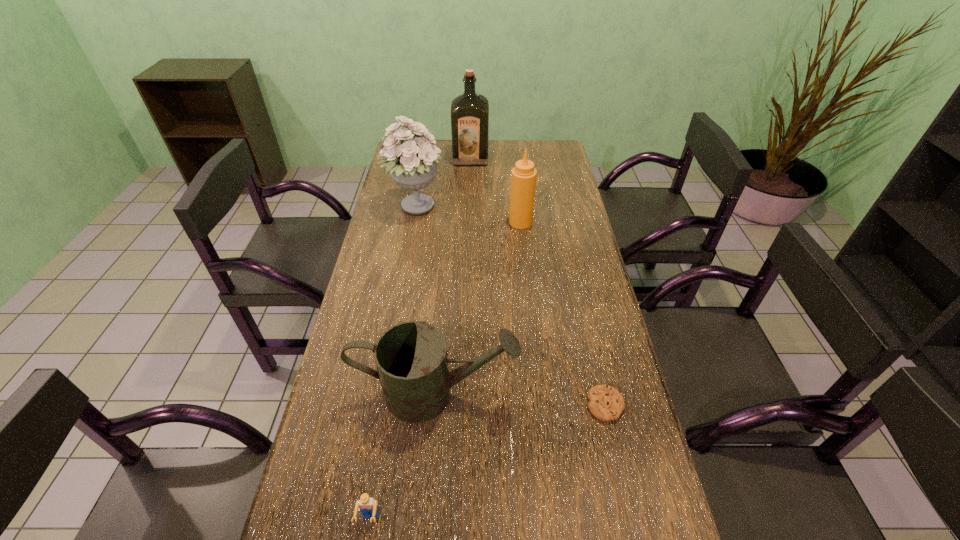
This screenshot has width=960, height=540. What are the coordinates of `liquor` in the screenshot? It's located at point(469,111).

Where is `bouquet`? The width and height of the screenshot is (960, 540). bouquet is located at coordinates (412, 164).

This screenshot has height=540, width=960. What are the coordinates of `the third tallest object` in the screenshot? It's located at (523, 179).

Image resolution: width=960 pixels, height=540 pixels. What are the coordinates of `the fifth object from left to right` in the screenshot? It's located at (523, 179).

I want to click on the fourth tallest object, so click(411, 358).

Where is `the fifth tallest object`? the fifth tallest object is located at coordinates (367, 505).

The width and height of the screenshot is (960, 540). What are the coordinates of `Lego` in the screenshot? It's located at (367, 505).

In order to click on cookie in this screenshot , I will do `click(606, 403)`.

You are a GUI agent. You are given a task and a screenshot of the screen. Output one action in this format:
    pyautogui.click(x=<x>, y=<y>)
    Task: Click on the shortest object
    The height and width of the screenshot is (540, 960).
    Given the screenshot: What is the action you would take?
    pyautogui.click(x=606, y=403)

The width and height of the screenshot is (960, 540). What are the coordinates of `free space located 0.210m on the label of the farthest object` in the screenshot? It's located at (469, 195).